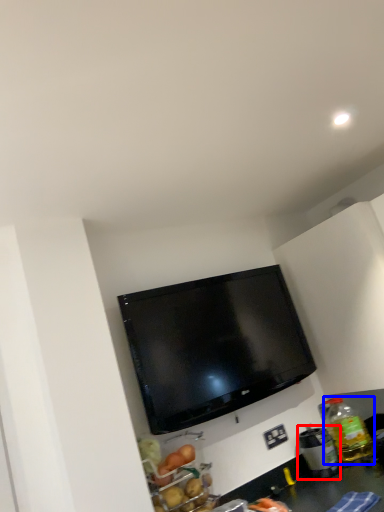
Question: Which point is closer to the camera, appliance (highlighted by a red box) or bottle (highlighted by a blue box)?

Choices:
 (A) appliance
 (B) bottle

Answer: (A)